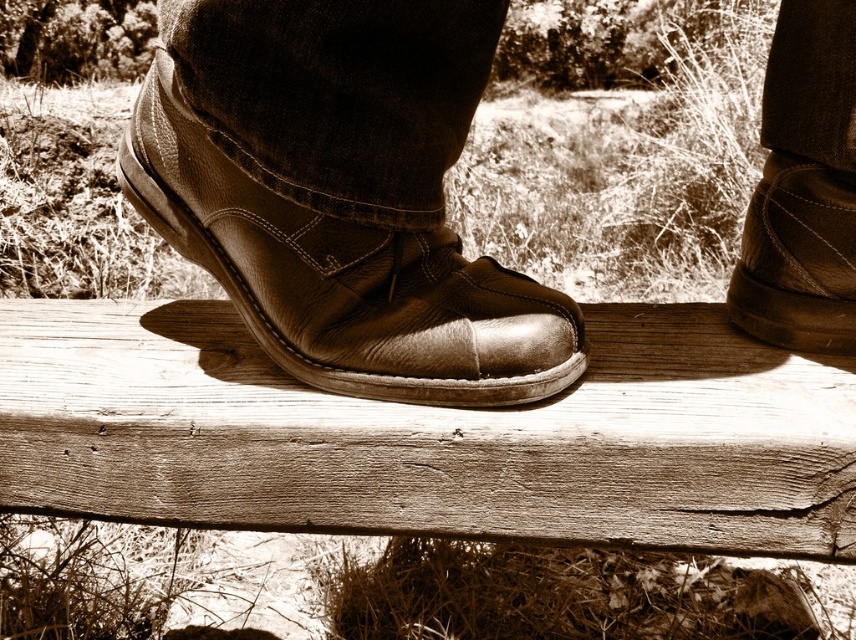
You are standing in front of the wooden surface where the person is resting their feet. There are two points marked on the surface. Can you determine which point is closer to you, point [563,317] or point [788,163]?

Point [563,317] is closer to the viewer than point [788,163].

You are a photographer setting up a tripod to capture the shiny brown leather shoe at center and the leather boot at right. The tripod requires a minimum of 18 inches between the two objects to frame them properly. Based on the scene, will you need to adjust the position of the tripod?

The shiny brown leather shoe at center is 17.53 inches from the leather boot at right, which is less than the required 18 inches. Therefore, you will need to adjust the position of the tripod to ensure proper framing.

Based on the photo, you are a photographer analyzing the composition of the image. The image has a point marked at coordinates point (343, 276). Based on the scene description, which object in the image does this point correspond to?

The point (343, 276) is on shiny brown leather shoe at center.